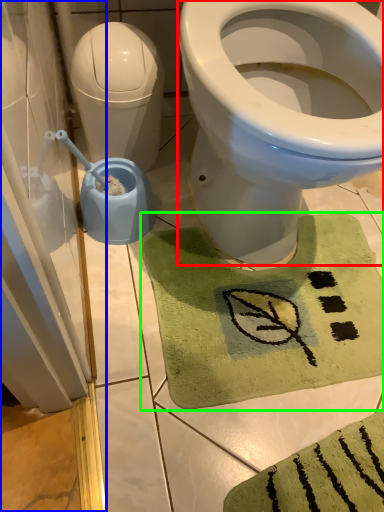
Question: Based on their relative distances, which object is nearer to bidet (highlighted by a red box)? Choose from screen door (highlighted by a blue box) and bath mat (highlighted by a green box).

Choices:
 (A) screen door
 (B) bath mat

Answer: (B)